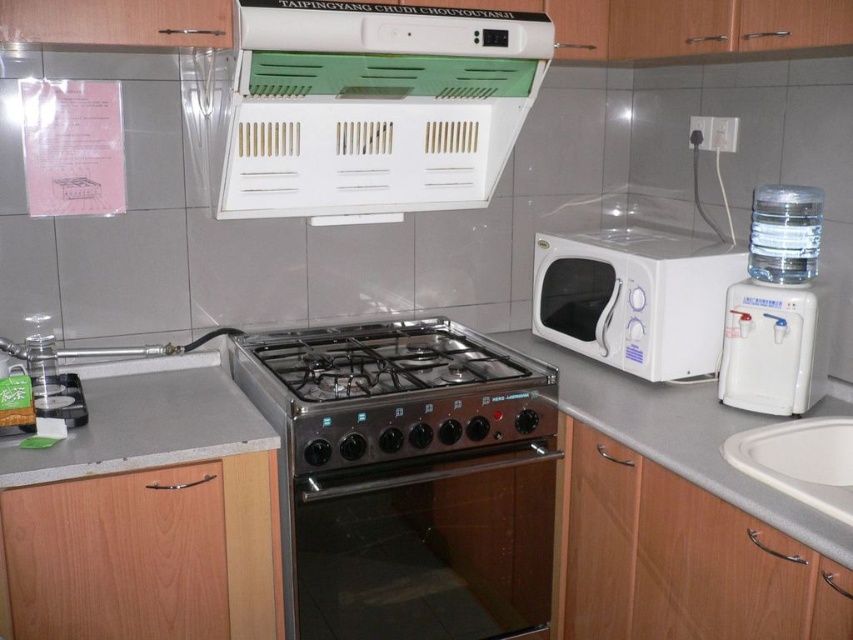
You are a kitchen assistant and need to pour water into a pot on the stainless steel gas stove at center. You have a choice between the white plastic water dispenser at right and the white glossy sink at lower right. Which one is closer to the stove?

The white glossy sink at lower right is closer to the stainless steel gas stove at center because the white plastic water dispenser at right is positioned on the right side of it, making the sink the nearest option.

You are standing in the kitchen and want to reach both points. Which point, point (805, 369) or point (815, 451), is easier to reach without moving your position?

Point (805, 369) is closer to the viewer than point (815, 451), so it is easier to reach without moving your position.

You are a technician checking the kitchen layout. The green plastic vent at upper center is located at coordinates point 0.166, 0.440. If you need to access it, which direction should you move from the center of the kitchen?

The green plastic vent at upper center is located at point (374, 106), which is to the left and slightly below the center of the kitchen. Therefore, you should move to the left and slightly downward from the center to access it.